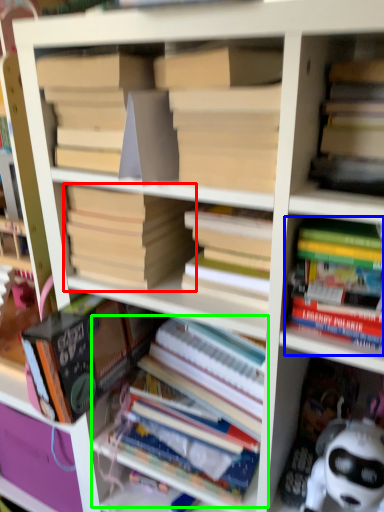
Question: Which object is positioned farthest from book (highlighted by a red box)? Select from book (highlighted by a blue box) and book (highlighted by a green box).

Choices:
 (A) book
 (B) book

Answer: (B)